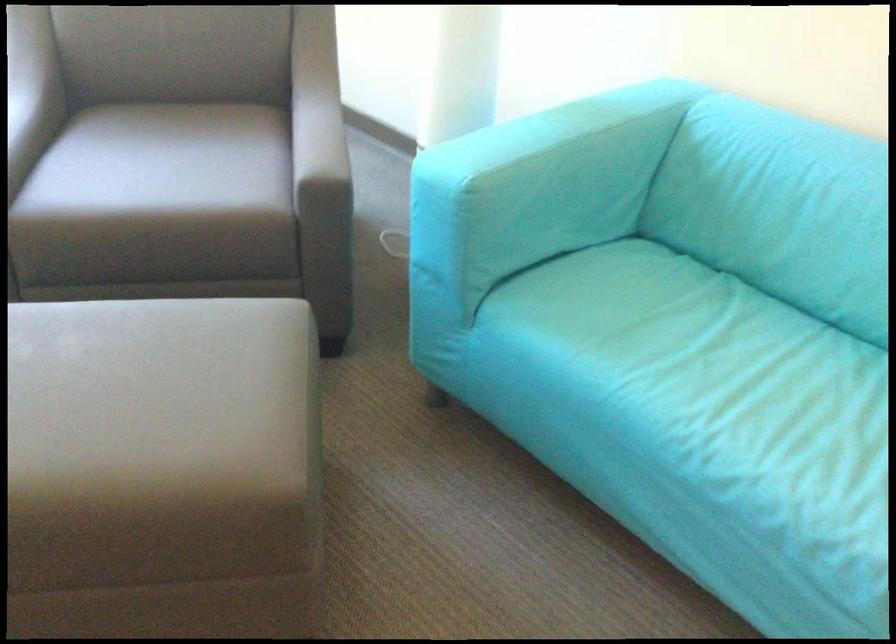
Find the location of `blue sofa armrest`. blue sofa armrest is located at coordinates (554, 162).